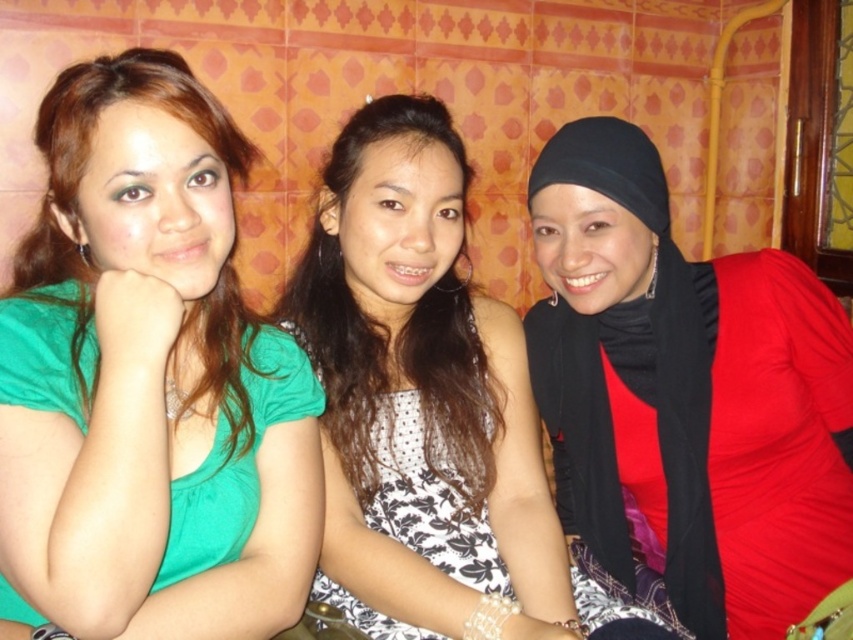
You are a photographer setting up for a group photo. You have two items to place in the scene for a photo shoot. You need to place a black matte hijab at right and a polka dot fabric dress at center. The client wants the larger item to be placed where it can be the focal point. Which item should you choose and where should you place it?

The black matte hijab at right is bigger than the polka dot fabric dress at center, so you should place the black matte hijab at right as the focal point since it is larger.

You are a photographer setting up for a group photo. You need to position a small prop between the black matte hijab at right and the white dotted dress at center. Based on their positions, where should you place the prop to ensure it is between them?

The prop should be placed between the black matte hijab at right and the white dotted dress at center, positioned below the black matte hijab at right since it is above the white dotted dress at center.

In the scene, there are two dresses at the center of the image. The first is a white dotted dress at center, and the second is a polka dot fabric dress at center. Which one is positioned to the right?

The white dotted dress at center is positioned to the right of the polka dot fabric dress at center.